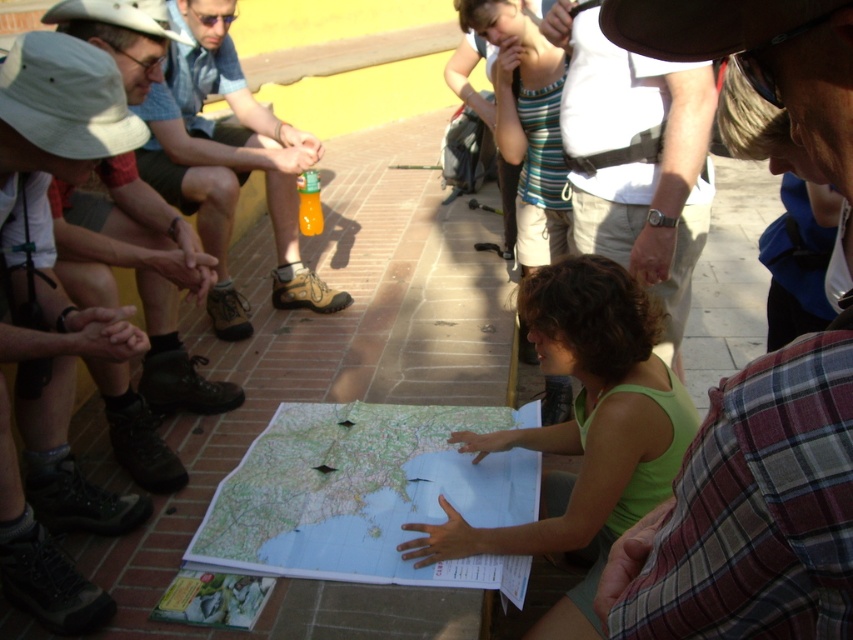
Does white paper map at center appear on the left side of white cotton shirt at upper center?

Correct, you'll find white paper map at center to the left of white cotton shirt at upper center.

Is white paper map at center closer to the viewer compared to white cotton shirt at upper center?

Yes, it is in front of white cotton shirt at upper center.

Which is behind, point (252, 460) or point (601, 99)?

The point (252, 460) is behind.

Where is `white paper map at center`? The width and height of the screenshot is (853, 640). white paper map at center is located at coordinates (369, 496).

Between white cotton shirt at upper center and orange plastic bottle at left, which one has more height?

orange plastic bottle at left

What do you see at coordinates (637, 157) in the screenshot?
I see `white cotton shirt at upper center` at bounding box center [637, 157].

Locate an element on the screen. Image resolution: width=853 pixels, height=640 pixels. white cotton shirt at upper center is located at coordinates (637, 157).

Can you confirm if green fabric shirt at center is bigger than white cotton shirt at upper center?

No, green fabric shirt at center is not bigger than white cotton shirt at upper center.

Which is behind, point (505, 531) or point (614, 168)?

Positioned behind is point (614, 168).

Is point (637, 467) closer to viewer compared to point (704, 124)?

Yes, it is.

At what (x,y) coordinates should I click in order to perform the action: click on green fabric shirt at center. Please return your answer as a coordinate pair (x, y). The image size is (853, 640). Looking at the image, I should click on (583, 416).